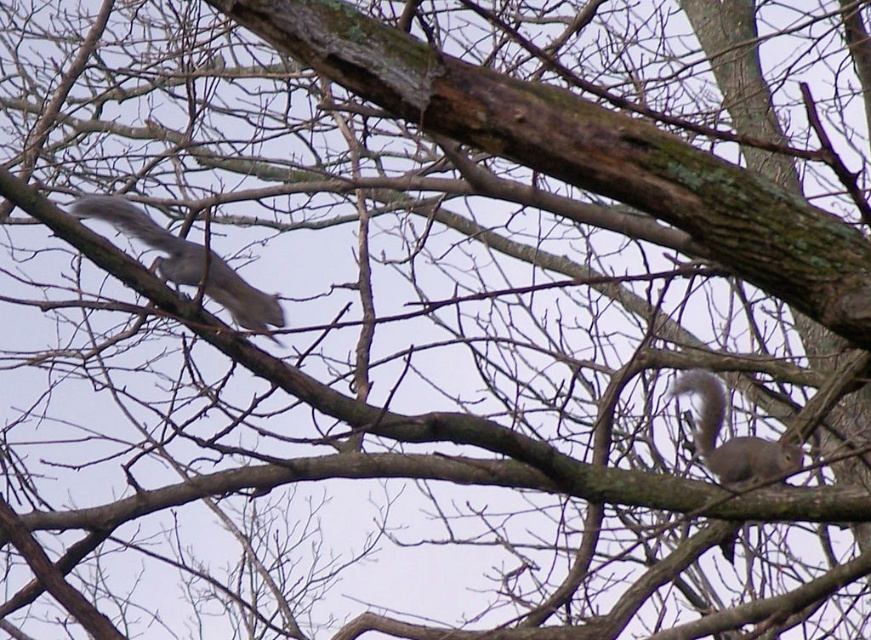
Who is taller, brown rough bark at center or gray furry squirrel at left?

Standing taller between the two is brown rough bark at center.

Does brown rough bark at center have a lesser width compared to gray furry squirrel at left?

In fact, brown rough bark at center might be wider than gray furry squirrel at left.

Is point (537, 92) positioned before point (230, 298)?

Yes, it is in front of point (230, 298).

Identify the location of brown rough bark at center. The width and height of the screenshot is (871, 640). [x=585, y=154].

How distant is gray furry squirrel at left from gray furry squirrel at right?

38.72 inches

Which is below, gray furry squirrel at left or gray furry squirrel at right?

Positioned lower is gray furry squirrel at right.

Between point (255, 314) and point (727, 545), which one is positioned behind?

Point (727, 545)

Identify the location of gray furry squirrel at left. The image size is (871, 640). (187, 262).

Does brown rough bark at center have a larger size compared to white fluffy tail at right?

Indeed, brown rough bark at center has a larger size compared to white fluffy tail at right.

Who is shorter, brown rough bark at center or white fluffy tail at right?

white fluffy tail at right is shorter.

This screenshot has height=640, width=871. Describe the element at coordinates (585, 154) in the screenshot. I see `brown rough bark at center` at that location.

This screenshot has height=640, width=871. In order to click on brown rough bark at center in this screenshot , I will do `click(585, 154)`.